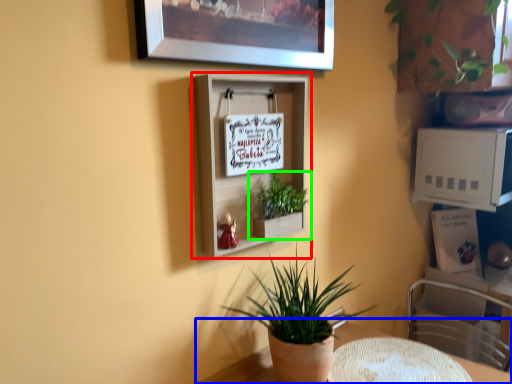
Question: Based on their relative distances, which object is nearer to shelf (highlighted by a red box)? Choose from table (highlighted by a blue box) and houseplant (highlighted by a green box).

Choices:
 (A) table
 (B) houseplant

Answer: (B)